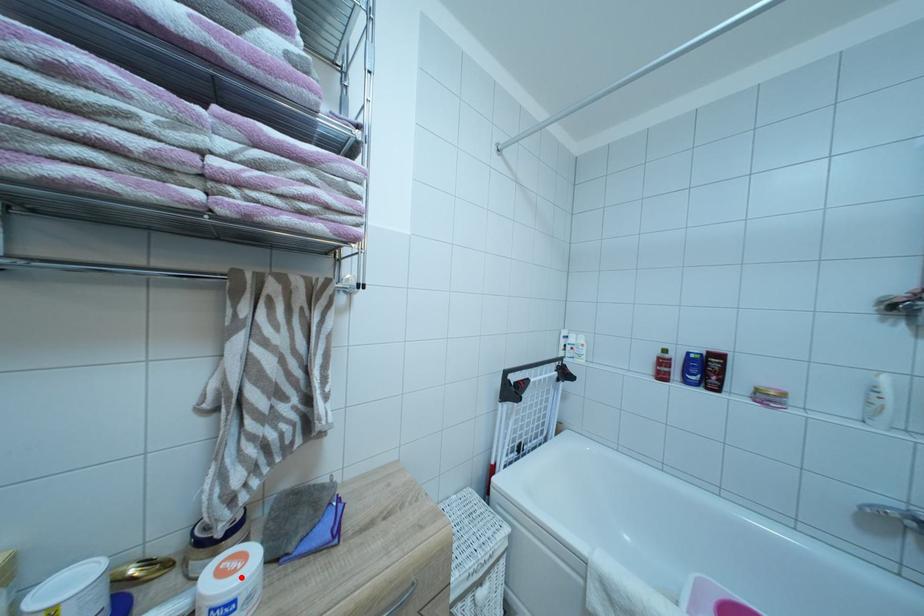
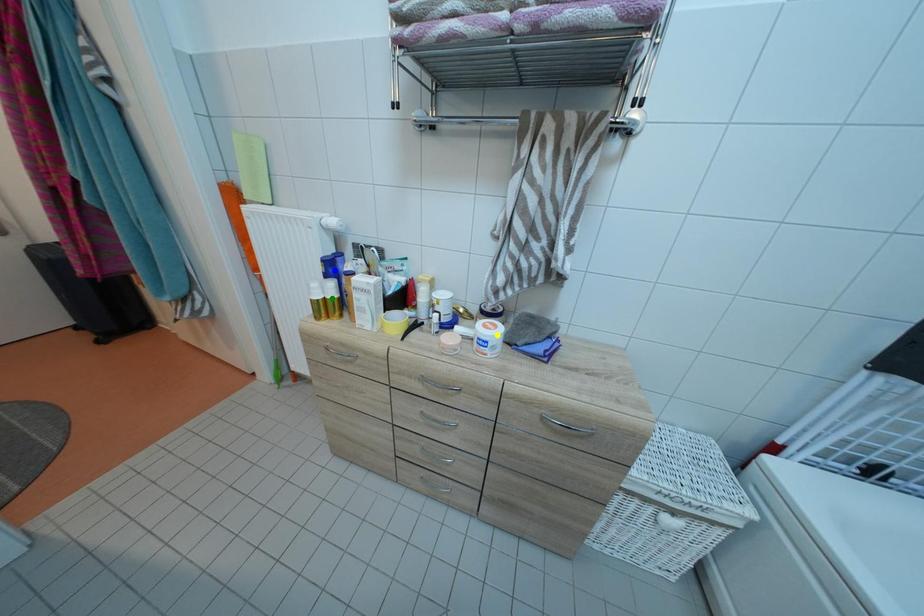
Question: I am providing you with two images of the same scene from different viewpoints. A red point is marked on the first image. You are given multiple points on the second image. Can you choose the point in image 2 that corresponds to the point in image 1?

Choices:
 (A) yellow point
 (B) green point
 (C) blue point

Answer: (A)